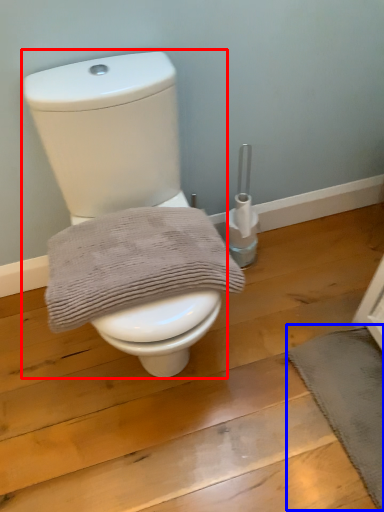
Question: Which object is further to the camera taking this photo, toilet (highlighted by a red box) or bath mat (highlighted by a blue box)?

Choices:
 (A) toilet
 (B) bath mat

Answer: (B)